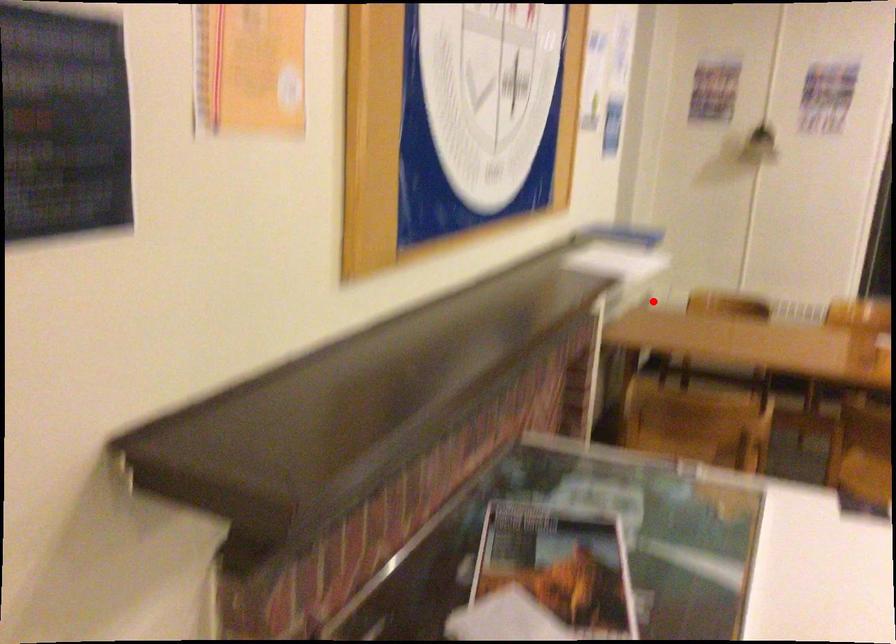
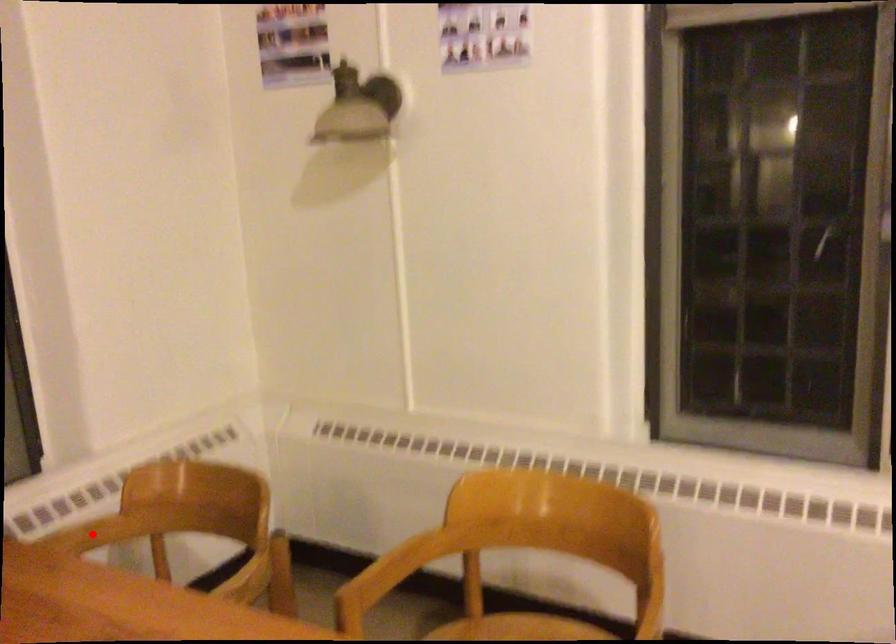
I am providing you with two images of the same scene from different viewpoints. A red point is marked on the first image and another point is marked on the second image. Is the red point in image1 aligned with the point shown in image2?

Yes